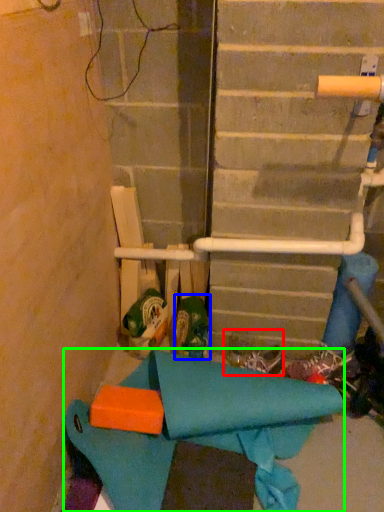
Question: Which object is positioned farthest from footwear (highlighted by a red box)? Select from footwear (highlighted by a blue box) and fabric (highlighted by a green box).

Choices:
 (A) footwear
 (B) fabric

Answer: (B)